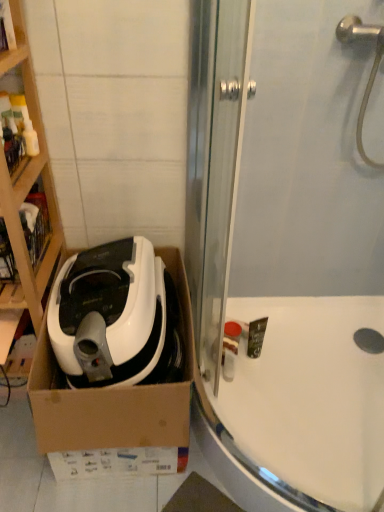
Question: Considering the relative sizes of white glossy bathtub at lower right and white cardboard box at left in the image provided, is white glossy bathtub at lower right shorter than white cardboard box at left?

Choices:
 (A) no
 (B) yes

Answer: (B)

Question: Is white glossy bathtub at lower right facing away from white cardboard box at left?

Choices:
 (A) yes
 (B) no

Answer: (B)

Question: Is white glossy bathtub at lower right further to the viewer compared to white cardboard box at left?

Choices:
 (A) yes
 (B) no

Answer: (A)

Question: Is white glossy bathtub at lower right aimed at white cardboard box at left?

Choices:
 (A) no
 (B) yes

Answer: (A)

Question: Is white glossy bathtub at lower right thinner than white cardboard box at left?

Choices:
 (A) yes
 (B) no

Answer: (B)

Question: In terms of size, does transparent glass shower door at upper center appear bigger or smaller than white matte/soft plastic at left?

Choices:
 (A) small
 (B) big

Answer: (B)

Question: From the image's perspective, relative to white matte/soft plastic at left, is transparent glass shower door at upper center above or below?

Choices:
 (A) below
 (B) above

Answer: (B)

Question: In the image, is transparent glass shower door at upper center positioned in front of or behind white matte/soft plastic at left?

Choices:
 (A) behind
 (B) front

Answer: (B)

Question: From a real-world perspective, is transparent glass shower door at upper center above or below white matte/soft plastic at left?

Choices:
 (A) below
 (B) above

Answer: (B)

Question: In terms of width, does white matte/soft plastic at left look wider or thinner when compared to white cardboard box at left?

Choices:
 (A) wide
 (B) thin

Answer: (A)

Question: Is white matte/soft plastic at left spatially inside white cardboard box at left, or outside of it?

Choices:
 (A) inside
 (B) outside

Answer: (B)

Question: From the image's perspective, is white matte/soft plastic at left positioned above or below white cardboard box at left?

Choices:
 (A) above
 (B) below

Answer: (B)

Question: Considering the relative positions of white matte/soft plastic at left and white cardboard box at left in the image provided, is white matte/soft plastic at left to the left or to the right of white cardboard box at left?

Choices:
 (A) right
 (B) left

Answer: (A)

Question: Considering the positions of point (33, 320) and point (127, 371), is point (33, 320) closer or farther from the camera than point (127, 371)?

Choices:
 (A) farther
 (B) closer

Answer: (A)

Question: Is white cardboard box at left wider or thinner than white matte/soft plastic at left?

Choices:
 (A) thin
 (B) wide

Answer: (A)